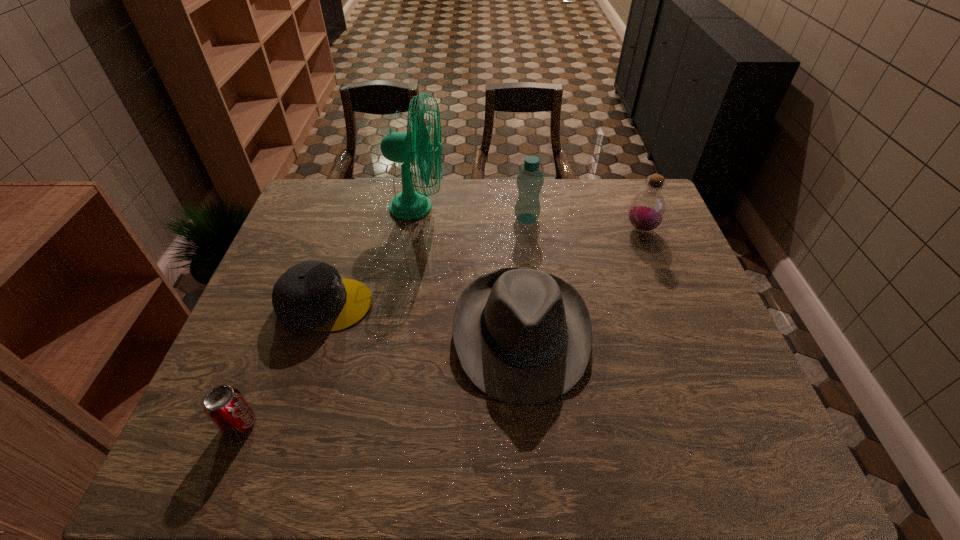
Where is `free location located on the right of the nearest object`? Image resolution: width=960 pixels, height=540 pixels. free location located on the right of the nearest object is located at coordinates (324, 424).

In order to click on vacant space situated on the front-facing side of the cap in this screenshot , I will do `click(464, 305)`.

At what (x,y) coordinates should I click in order to perform the action: click on fan located in the far edge section of the desktop. Please return your answer as a coordinate pair (x, y). Looking at the image, I should click on (416, 144).

Find the location of `object present at the near edge`. object present at the near edge is located at coordinates tap(225, 406).

Locate an element on the screen. The height and width of the screenshot is (540, 960). soda can at the left edge is located at coordinates (225, 406).

At what (x,y) coordinates should I click in order to perform the action: click on cap at the left edge. Please return your answer as a coordinate pair (x, y). This screenshot has height=540, width=960. Looking at the image, I should click on (310, 296).

Identify the location of object that is at the right edge. tap(647, 210).

The image size is (960, 540). I want to click on object that is at the near left corner, so click(x=225, y=406).

This screenshot has height=540, width=960. I want to click on object located in the far right corner section of the desktop, so coord(647,210).

The width and height of the screenshot is (960, 540). Find the location of `vacant space at the far edge of the desktop`. vacant space at the far edge of the desktop is located at coordinates (571, 204).